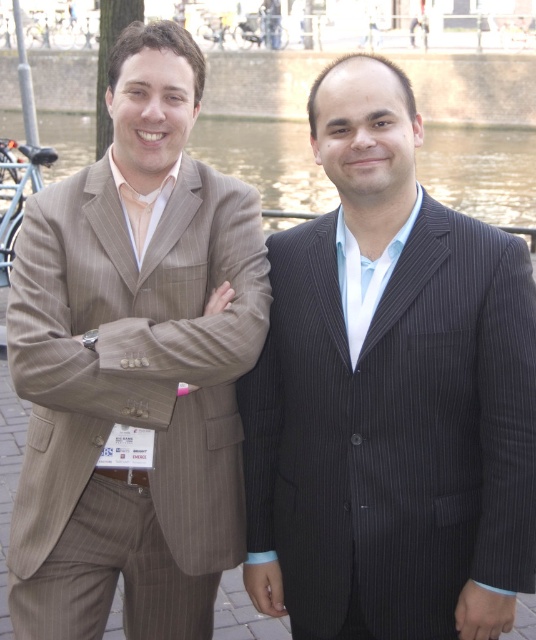
You are a photographer standing at the camera position. You want to focus on the point that is closer to you. Which point should you choose between point (x=276, y=416) and point (x=295, y=157)?

Point (x=276, y=416) is closer to the camera than point (x=295, y=157), so you should choose point (x=276, y=416) to focus on.

You are a photographer preparing to take a group photo of the dark pinstripe suit at center and the brown pinstripe suit at left. Based on their current positions, which of the two should you position slightly forward to ensure both are framed equally in height?

The dark pinstripe suit at center has a lesser height compared to brown pinstripe suit at left, so you should position the dark pinstripe suit at center slightly forward to balance their heights in the photo.

Consider the image. You are a photographer standing at a distance from the dark pinstripe suit at center. You want to take a closeup photo of it without moving closer. Which camera feature should you adjust to achieve this?

You should adjust the zoom feature on your camera to magnify the image of the dark pinstripe suit at center from a distance of 9.04 meters.